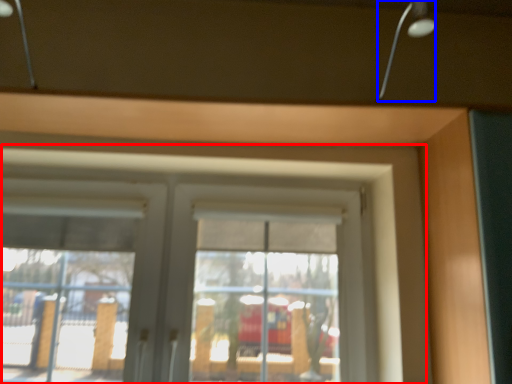
Question: Which object appears farthest to the camera in this image, window (highlighted by a red box) or lamp (highlighted by a blue box)?

Choices:
 (A) window
 (B) lamp

Answer: (A)